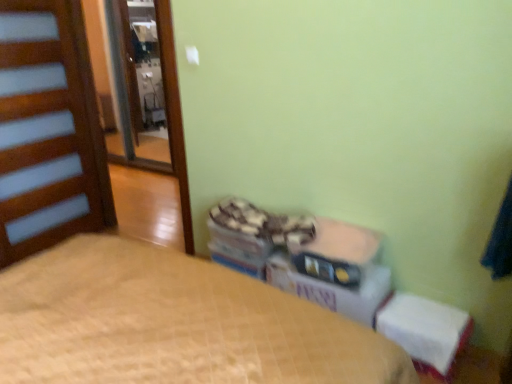
Question: Is brown wooden screen door at left taller or shorter than beige quilted bed at center?

Choices:
 (A) short
 (B) tall

Answer: (B)

Question: From the image's perspective, is brown wooden screen door at left above or below beige quilted bed at center?

Choices:
 (A) above
 (B) below

Answer: (A)

Question: Which is farther from the brown wooden screen door at left?

Choices:
 (A) white fabric changing table at lower right
 (B) wooden door at left
 (C) beige quilted bed at center
 (D) matte plastic storage box at center
 (E) white cardboard box at center

Answer: (A)

Question: Which is nearer to the white fabric changing table at lower right?

Choices:
 (A) white cardboard box at center
 (B) wooden door at left
 (C) matte plastic storage box at center
 (D) beige quilted bed at center
 (E) brown wooden screen door at left

Answer: (A)